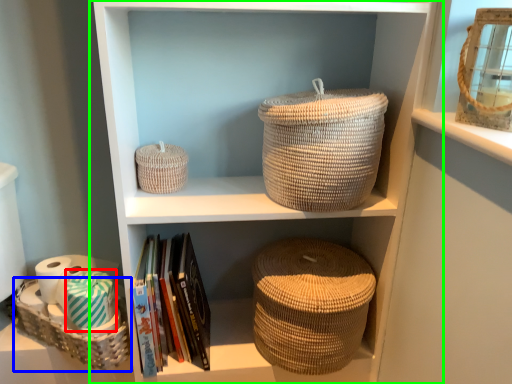
Question: Which object is positioned closest to toilet paper (highlighted by a red box)? Select from basket (highlighted by a blue box) and shelf (highlighted by a green box).

Choices:
 (A) basket
 (B) shelf

Answer: (A)